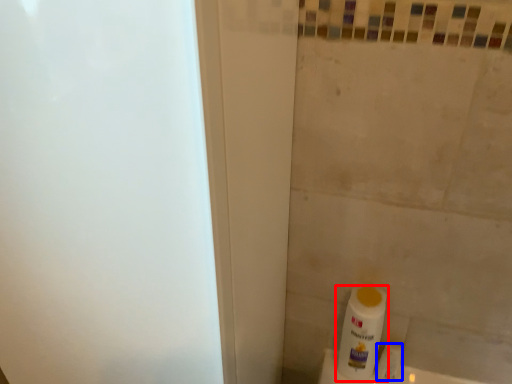
Question: Which object is further to the camera taking this photo, bottle (highlighted by a red box) or toilet paper (highlighted by a blue box)?

Choices:
 (A) bottle
 (B) toilet paper

Answer: (B)